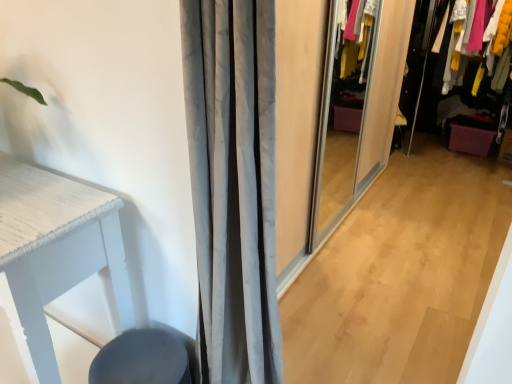
Question: Is velvet purple drawer at right looking in the opposite direction of matte black swivel chair at lower left?

Choices:
 (A) yes
 (B) no

Answer: (B)

Question: From a real-world perspective, does velvet purple drawer at right stand above matte black swivel chair at lower left?

Choices:
 (A) yes
 (B) no

Answer: (A)

Question: From the image's perspective, is velvet purple drawer at right on top of matte black swivel chair at lower left?

Choices:
 (A) no
 (B) yes

Answer: (B)

Question: Is velvet purple drawer at right taller than matte black swivel chair at lower left?

Choices:
 (A) yes
 (B) no

Answer: (A)

Question: Does velvet purple drawer at right have a larger size compared to matte black swivel chair at lower left?

Choices:
 (A) no
 (B) yes

Answer: (B)

Question: Is velvet purple drawer at right further to the viewer compared to matte black swivel chair at lower left?

Choices:
 (A) no
 (B) yes

Answer: (B)

Question: Can you confirm if matte black swivel chair at lower left is shorter than velvet purple drawer at right?

Choices:
 (A) yes
 (B) no

Answer: (A)

Question: Can you confirm if matte black swivel chair at lower left is smaller than velvet purple drawer at right?

Choices:
 (A) no
 (B) yes

Answer: (B)

Question: From a real-world perspective, is matte black swivel chair at lower left on top of velvet purple drawer at right?

Choices:
 (A) no
 (B) yes

Answer: (A)

Question: Considering the relative sizes of matte black swivel chair at lower left and velvet purple drawer at right in the image provided, is matte black swivel chair at lower left thinner than velvet purple drawer at right?

Choices:
 (A) yes
 (B) no

Answer: (A)

Question: Is matte black swivel chair at lower left facing away from velvet purple drawer at right?

Choices:
 (A) no
 (B) yes

Answer: (B)

Question: Does matte black swivel chair at lower left come behind velvet purple drawer at right?

Choices:
 (A) yes
 (B) no

Answer: (B)

Question: Is point (170, 367) positioned closer to the camera than point (453, 104)?

Choices:
 (A) farther
 (B) closer

Answer: (B)